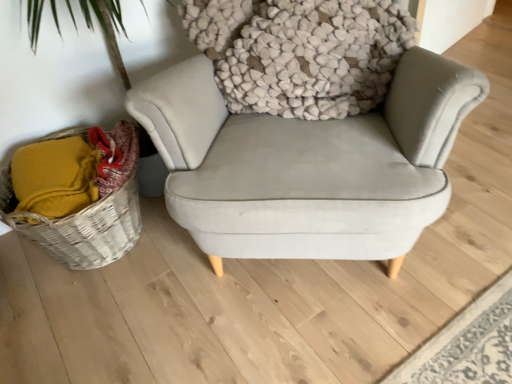
Identify the location of vacant area that lies in front of woven wicker basket at lower left. Image resolution: width=512 pixels, height=384 pixels. point(108,325).